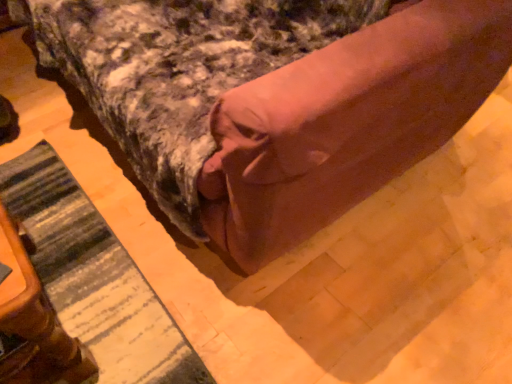
Question: Does wooden table at lower left have a lesser width compared to brown fabric bed at center?

Choices:
 (A) no
 (B) yes

Answer: (B)

Question: Is wooden table at lower left to the left of brown fabric bed at center from the viewer's perspective?

Choices:
 (A) yes
 (B) no

Answer: (A)

Question: Can you confirm if wooden table at lower left is shorter than brown fabric bed at center?

Choices:
 (A) yes
 (B) no

Answer: (A)

Question: Can we say wooden table at lower left lies outside brown fabric bed at center?

Choices:
 (A) yes
 (B) no

Answer: (A)

Question: Would you consider wooden table at lower left to be distant from brown fabric bed at center?

Choices:
 (A) no
 (B) yes

Answer: (A)

Question: Considering the relative sizes of wooden table at lower left and brown fabric bed at center in the image provided, is wooden table at lower left taller than brown fabric bed at center?

Choices:
 (A) yes
 (B) no

Answer: (B)

Question: Does brown fabric bed at center have a lesser height compared to wooden table at lower left?

Choices:
 (A) no
 (B) yes

Answer: (A)

Question: Can you confirm if brown fabric bed at center is positioned to the right of wooden table at lower left?

Choices:
 (A) no
 (B) yes

Answer: (B)

Question: Can you confirm if brown fabric bed at center is thinner than wooden table at lower left?

Choices:
 (A) yes
 (B) no

Answer: (B)

Question: Is brown fabric bed at center directly adjacent to wooden table at lower left?

Choices:
 (A) no
 (B) yes

Answer: (A)

Question: From a real-world perspective, does brown fabric bed at center sit lower than wooden table at lower left?

Choices:
 (A) yes
 (B) no

Answer: (B)

Question: Would you consider brown fabric bed at center to be distant from wooden table at lower left?

Choices:
 (A) yes
 (B) no

Answer: (B)

Question: Does brown fabric bed at center have a lesser height compared to striped fabric mat at lower left?

Choices:
 (A) no
 (B) yes

Answer: (A)